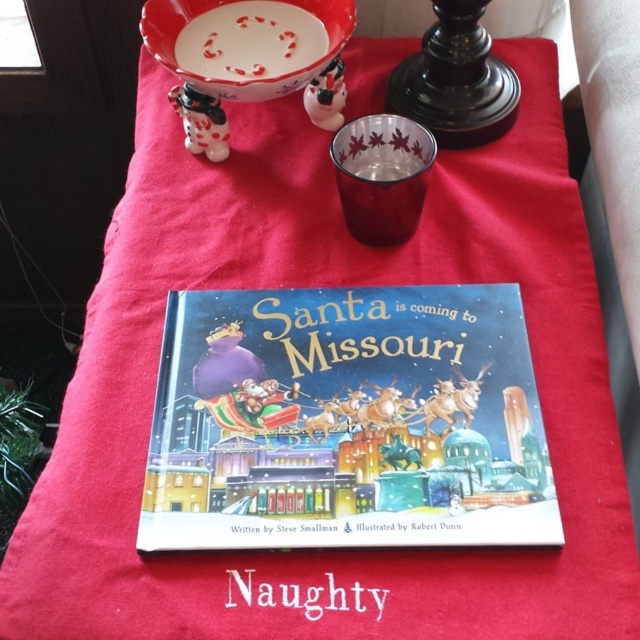
Question: Considering the relative positions of hardcover book at center and white ceramic bowl at upper center in the image provided, where is hardcover book at center located with respect to white ceramic bowl at upper center?

Choices:
 (A) right
 (B) left

Answer: (A)

Question: Can you confirm if hardcover book at center is bigger than white ceramic bowl at upper center?

Choices:
 (A) no
 (B) yes

Answer: (B)

Question: Which point appears closest to the camera in this image?

Choices:
 (A) (301, 4)
 (B) (224, 474)

Answer: (B)

Question: Is hardcover book at center positioned in front of white ceramic bowl at upper center?

Choices:
 (A) yes
 (B) no

Answer: (A)

Question: Among these points, which one is nearest to the camera?

Choices:
 (A) (170, 35)
 (B) (458, 477)

Answer: (B)

Question: Which object is closer to the camera taking this photo?

Choices:
 (A) white ceramic bowl at upper center
 (B) hardcover book at center

Answer: (B)